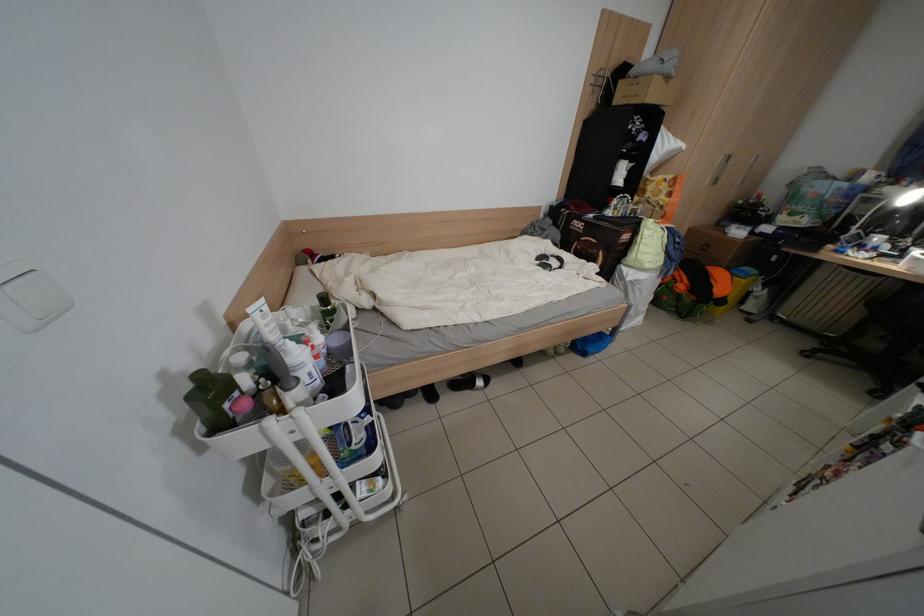
The location [550,262] corresponds to which object?

It refers to a black headphones.